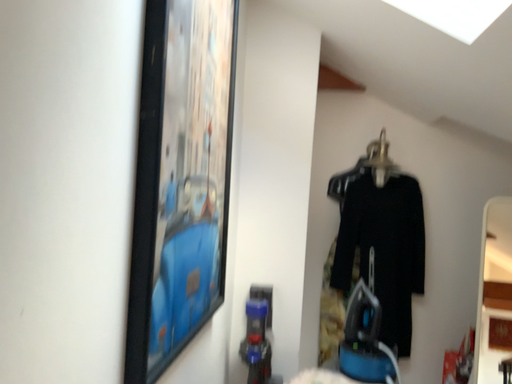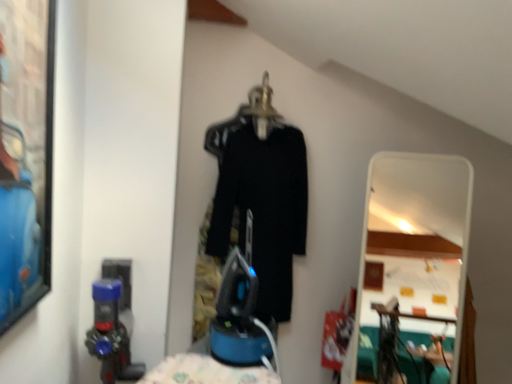
Question: Which way did the camera rotate in the video?

Choices:
 (A) rotated left
 (B) rotated right

Answer: (B)